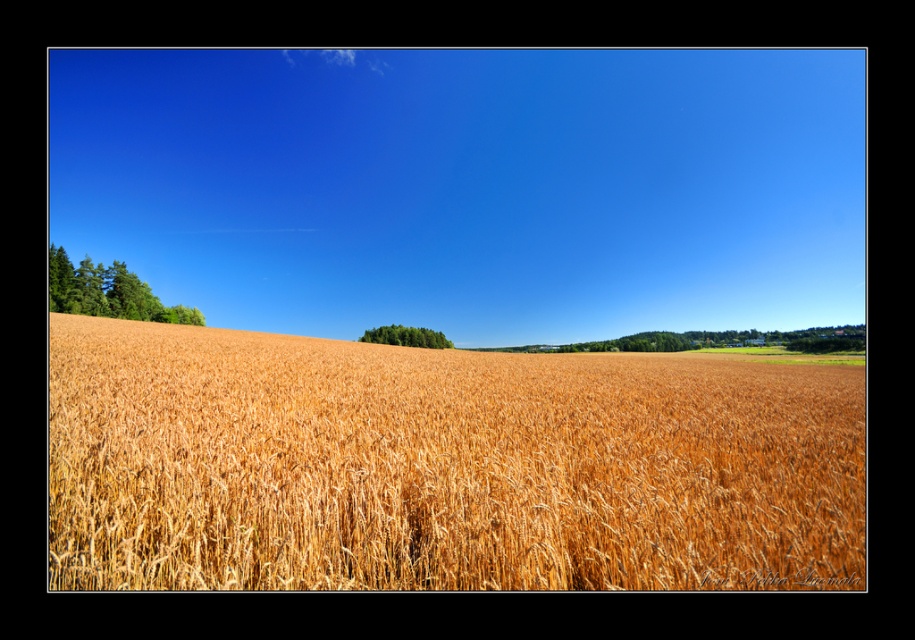
Question: Is golden wheat field at center to the left of green leafy trees at center from the viewer's perspective?

Choices:
 (A) yes
 (B) no

Answer: (B)

Question: Which point is closer to the camera taking this photo?

Choices:
 (A) (817, 509)
 (B) (429, 339)

Answer: (A)

Question: Can you confirm if golden wheat field at center is wider than green textured trees at left?

Choices:
 (A) yes
 (B) no

Answer: (A)

Question: Which point is farther to the camera?

Choices:
 (A) green leafy trees at center
 (B) green textured trees at left

Answer: (A)

Question: Does golden wheat field at center appear on the left side of green leafy trees at center?

Choices:
 (A) no
 (B) yes

Answer: (A)

Question: Which object is farther from the camera taking this photo?

Choices:
 (A) golden wheat field at center
 (B) green leafy trees at center

Answer: (B)